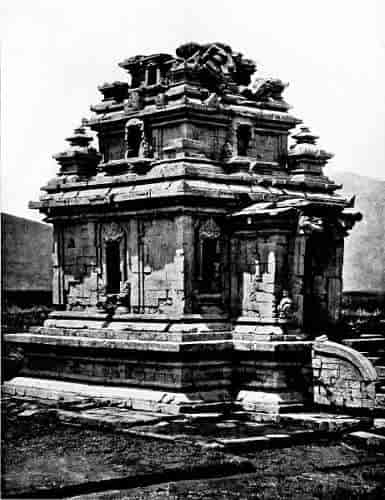
Locate an element on the screen. This screenshot has height=500, width=385. stair well is located at coordinates (340, 383).